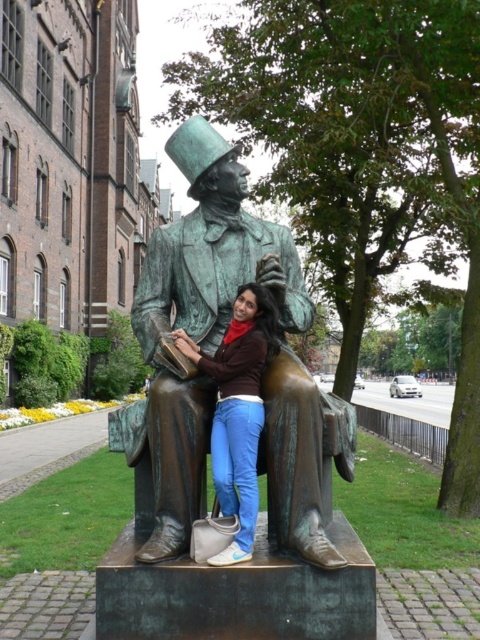
Can you confirm if green patina bronze statue at center is bigger than matte bronze statue at center?

Correct, green patina bronze statue at center is larger in size than matte bronze statue at center.

At what (x,y) coordinates should I click in order to perform the action: click on green patina bronze statue at center. Please return your answer as a coordinate pair (x, y). This screenshot has width=480, height=640. Looking at the image, I should click on pos(196,324).